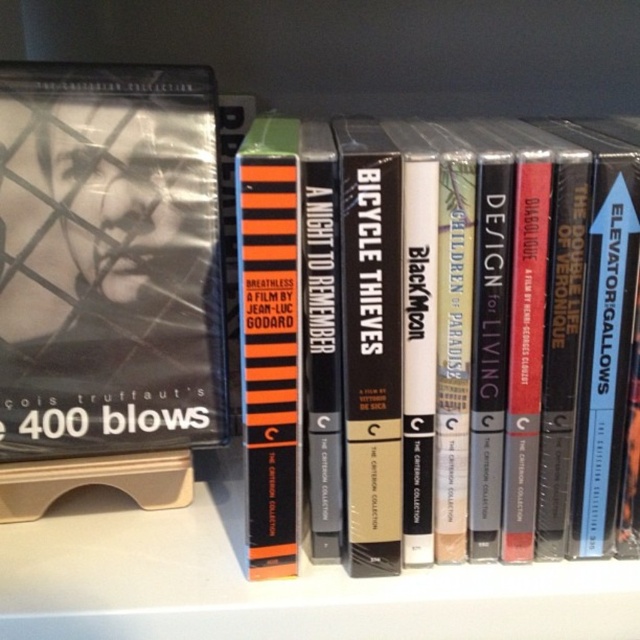
Question: Does black matte book at center have a larger size compared to orange striped book at center?

Choices:
 (A) yes
 (B) no

Answer: (A)

Question: Is black matte book at center thinner than orange striped book at center?

Choices:
 (A) yes
 (B) no

Answer: (B)

Question: Among these objects, which one is farthest from the camera?

Choices:
 (A) black matte book at center
 (B) orange striped book at center

Answer: (A)

Question: Among these points, which one is nearest to the camera?

Choices:
 (A) (266, 275)
 (B) (600, 348)

Answer: (A)

Question: Can you confirm if black matte book at center is thinner than orange striped book at center?

Choices:
 (A) yes
 (B) no

Answer: (B)

Question: Which of the following is the closest to the observer?

Choices:
 (A) orange striped book at center
 (B) black matte book at center

Answer: (A)